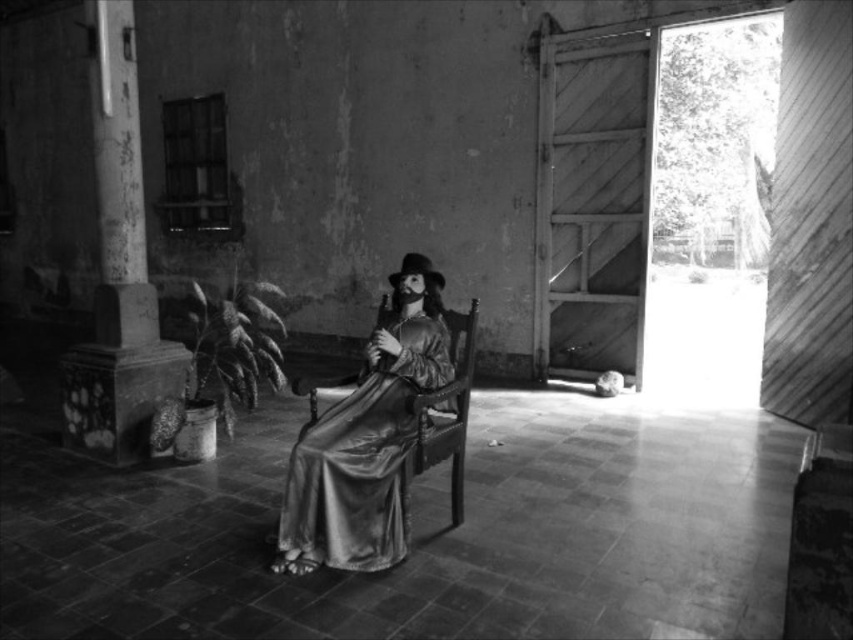
Can you confirm if silky gold dress at center is positioned below smooth stone column at left?

Correct, silky gold dress at center is located below smooth stone column at left.

The height and width of the screenshot is (640, 853). What do you see at coordinates (366, 440) in the screenshot?
I see `silky gold dress at center` at bounding box center [366, 440].

Is point (329, 467) farther from viewer compared to point (138, 208)?

No, (329, 467) is in front of (138, 208).

This screenshot has width=853, height=640. Identify the location of silky gold dress at center. (366, 440).